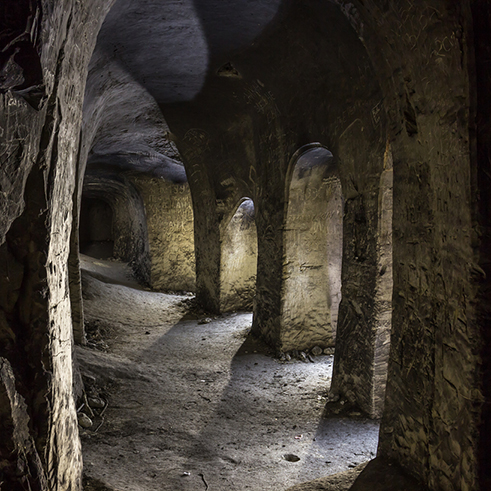
Locate an element on the screen. ceiling is located at coordinates (181, 67).